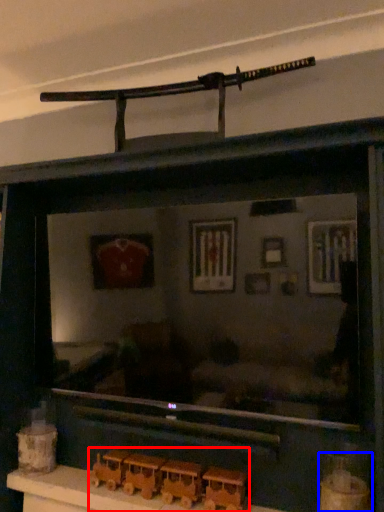
Question: Which object appears closest to the camera in this image, toy (highlighted by a red box) or toy (highlighted by a blue box)?

Choices:
 (A) toy
 (B) toy

Answer: (B)